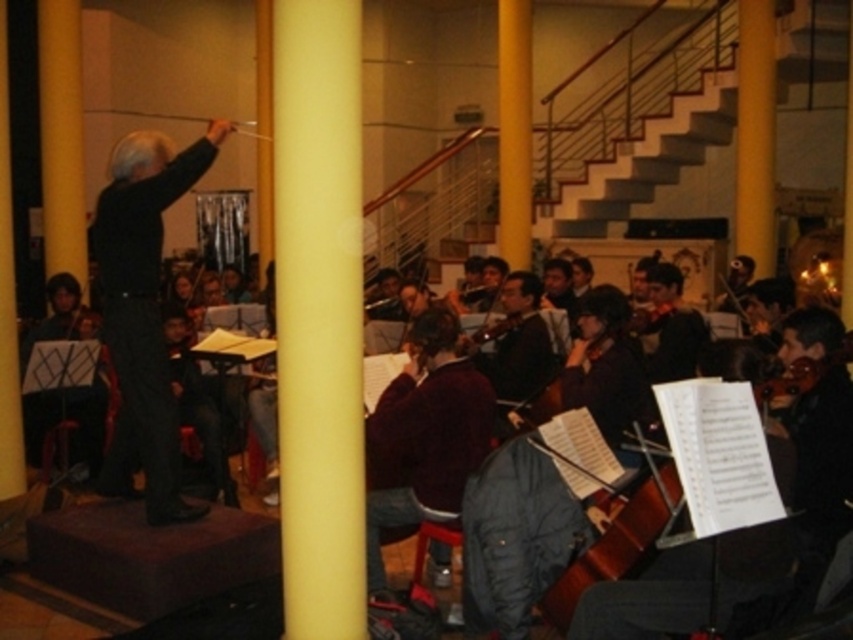
Does black matte conductor at center have a larger size compared to shiny brown violin at lower right?

Yes, black matte conductor at center is bigger than shiny brown violin at lower right.

Between point (125, 291) and point (822, 360), which one is positioned behind?

The point (125, 291) is behind.

Between point (115, 288) and point (790, 394), which one is positioned in front?

Point (790, 394)

Find the location of a particular element. black matte conductor at center is located at coordinates (143, 310).

Does yellow matte pole at center have a greater height compared to shiny brown violin at lower right?

Correct, yellow matte pole at center is much taller as shiny brown violin at lower right.

Which is in front, point (352, 429) or point (805, 376)?

Point (352, 429) is in front.

This screenshot has height=640, width=853. What are the coordinates of `yellow matte pole at center` in the screenshot? It's located at (318, 314).

Does black matte conductor at center have a smaller size compared to maroon sweater at center?

Incorrect, black matte conductor at center is not smaller in size than maroon sweater at center.

Find the location of a particular element. This screenshot has width=853, height=640. black matte conductor at center is located at coordinates (143, 310).